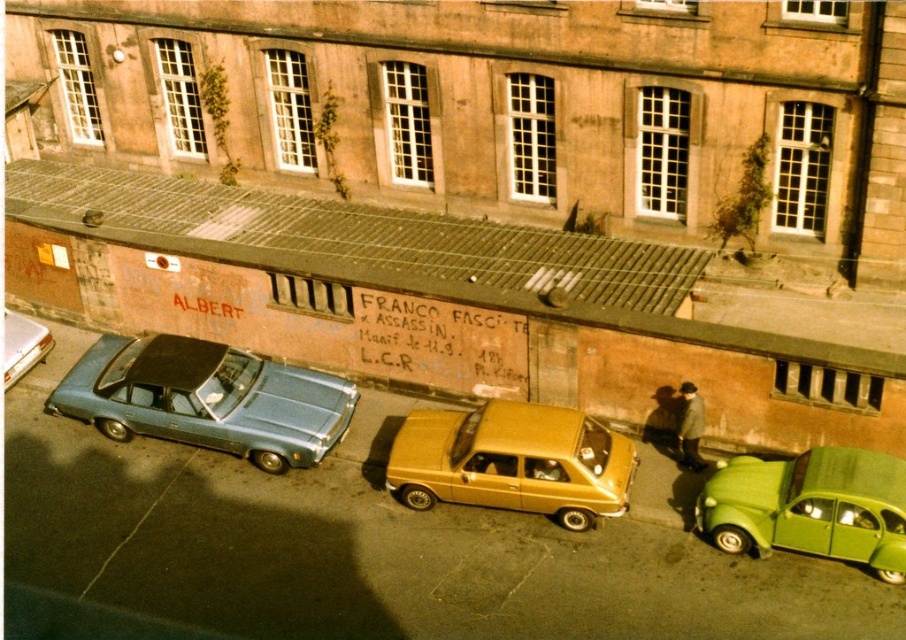
You are standing in front of the building and want to determine which of the two points, point (143, 433) or point (32, 340), is closer to you. Based on the scene description, which point is nearer?

Point (143, 433) is closer to the viewer than point (32, 340).

You are a delivery person needing to park your 2.5 meter wide van between the matte blue sedan at left and the green matte car at lower right. Can you fit your van in the space between them?

The distance between the matte blue sedan at left and the green matte car at lower right is 7.97 meters. Since your van is 2.5 meters wide, there is sufficient space to park it between them.

You are standing in front of the building with reddish brown facade and want to take a photo of the graffiti with your phone. The camera on your phone has a minimum focus distance of 1 meter. Can you focus on the point at coordinates point (326,396) without moving closer?

The point at coordinates point (326,396) is 15.73 meters away from the camera. Since the minimum focus distance of your phone camera is 1 meter, you can focus on the point as it is beyond the minimum distance required.